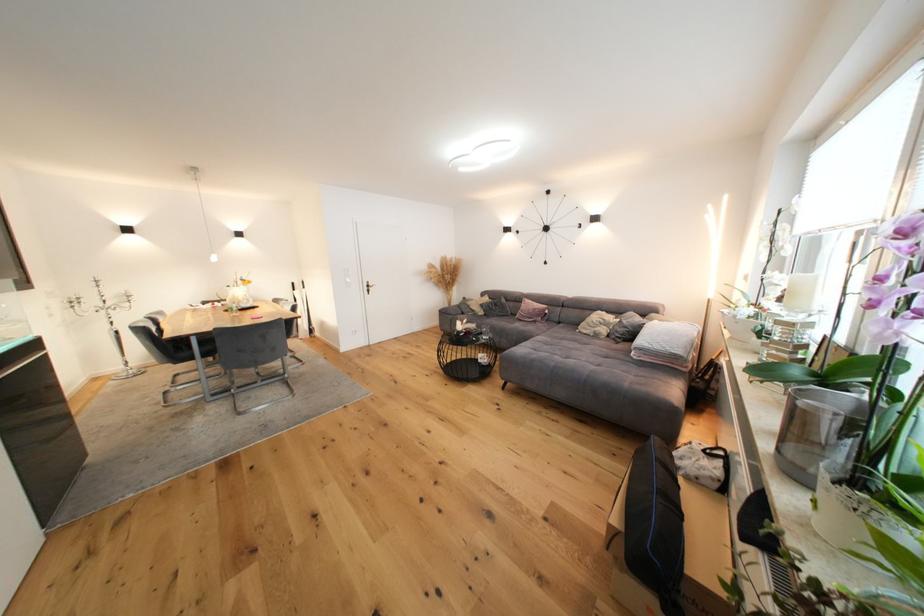
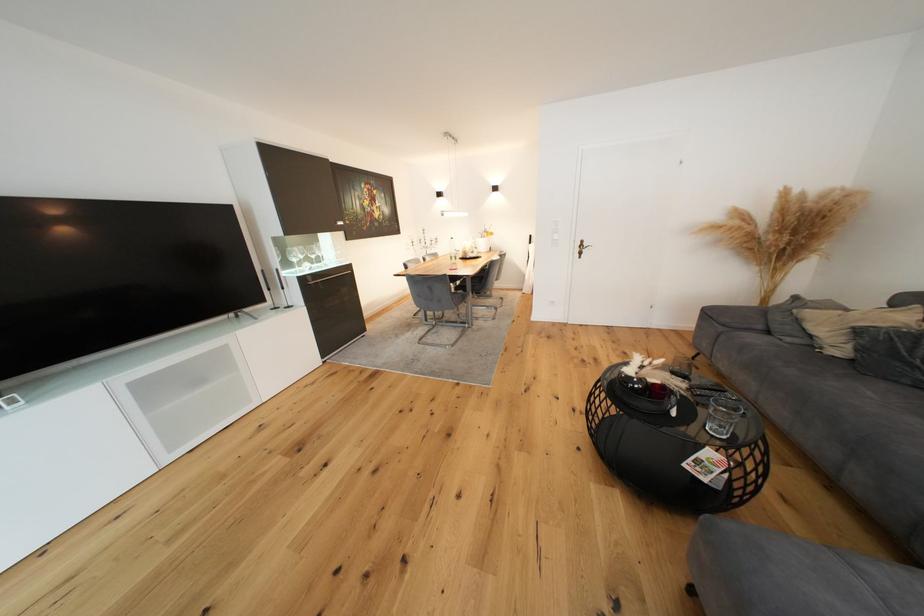
Where in the second image is the point corresponding to point (466, 334) from the first image?

(637, 379)